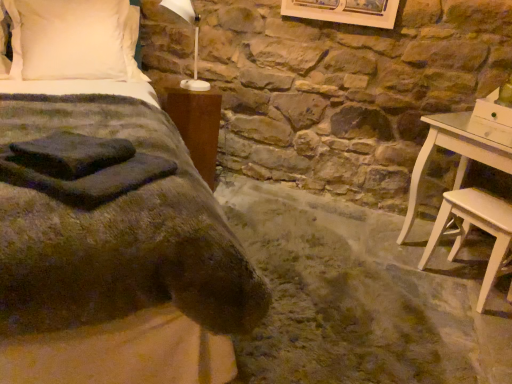
Where is `free region under light wood stool at lower right (from a real-world perspective)`? free region under light wood stool at lower right (from a real-world perspective) is located at coordinates (461, 289).